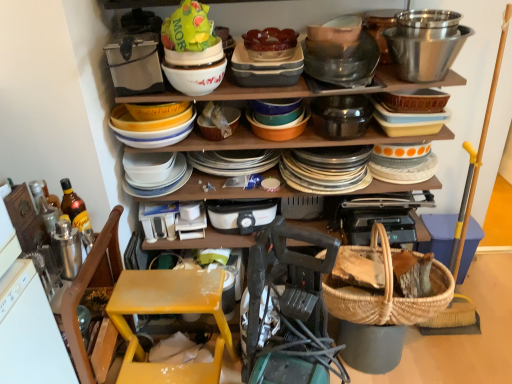
At what (x,y) coordinates should I click in order to perform the action: click on blank space above black plastic toaster at center, the second appliance viewed from the top (from a real-world perspective). Please return your answer as a coordinate pair (x, y). This screenshot has width=512, height=384. Looking at the image, I should click on (234, 205).